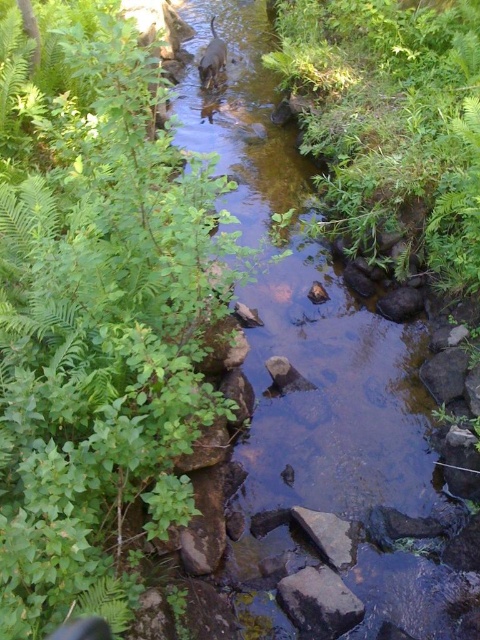
Question: Can you confirm if green leafy plant at center is bigger than clear water stream at center?

Choices:
 (A) no
 (B) yes

Answer: (B)

Question: Among these objects, which one is nearest to the camera?

Choices:
 (A) gray rough rock at center
 (B) brown fur dog at center
 (C) clear water stream at center
 (D) green leafy plant at center

Answer: (D)

Question: Which point is closer to the camera?

Choices:
 (A) (299, 605)
 (B) (216, 35)
 (C) (82, 432)
 (D) (300, 304)

Answer: (C)

Question: Does gray rough rock at center appear over brown fur dog at center?

Choices:
 (A) no
 (B) yes

Answer: (A)

Question: Among these points, which one is farthest from the camera?

Choices:
 (A) (287, 536)
 (B) (217, 45)
 (C) (134, 467)
 (D) (348, 600)

Answer: (B)

Question: Is green leafy plant at center thinner than clear water stream at center?

Choices:
 (A) yes
 (B) no

Answer: (B)